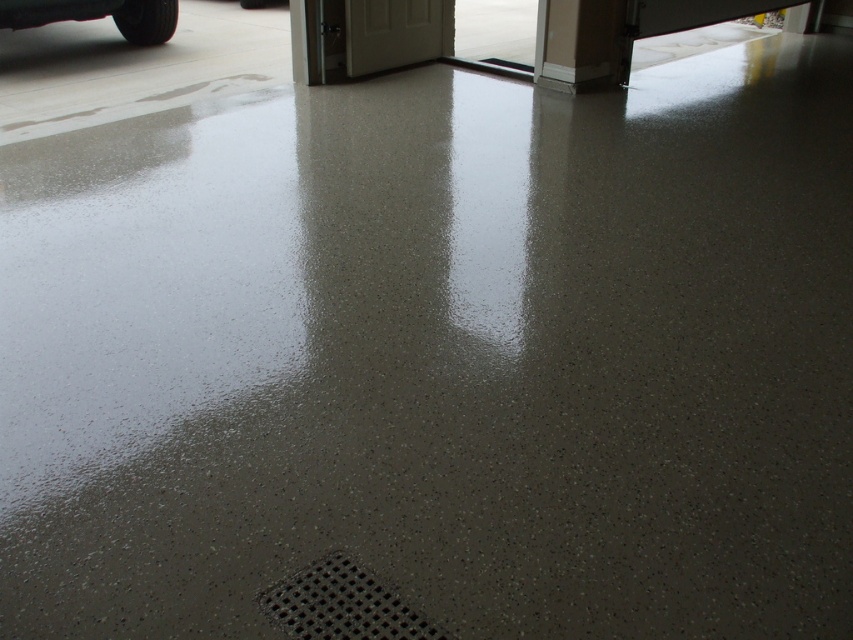
Question: Can you confirm if black textured drain at lower center is thinner than shiny black car at upper left?

Choices:
 (A) no
 (B) yes

Answer: (B)

Question: Which point appears farthest from the camera in this image?

Choices:
 (A) (0, 4)
 (B) (320, 616)

Answer: (A)

Question: Considering the relative positions of black textured drain at lower center and shiny black car at upper left in the image provided, where is black textured drain at lower center located with respect to shiny black car at upper left?

Choices:
 (A) right
 (B) left

Answer: (A)

Question: Does black textured drain at lower center come behind shiny black car at upper left?

Choices:
 (A) no
 (B) yes

Answer: (A)

Question: Which object is farther from the camera taking this photo?

Choices:
 (A) black textured drain at lower center
 (B) shiny black car at upper left

Answer: (B)